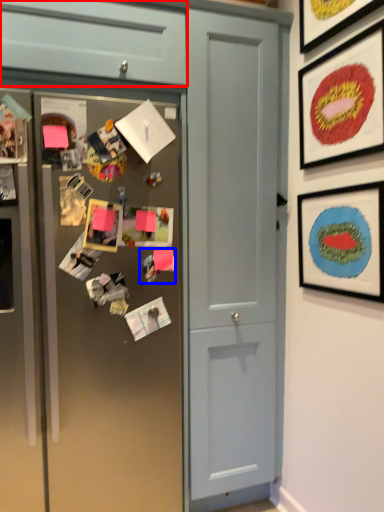
Question: Which of the following is the farthest to the observer, cabinetry (highlighted by a red box) or art (highlighted by a blue box)?

Choices:
 (A) cabinetry
 (B) art

Answer: (B)